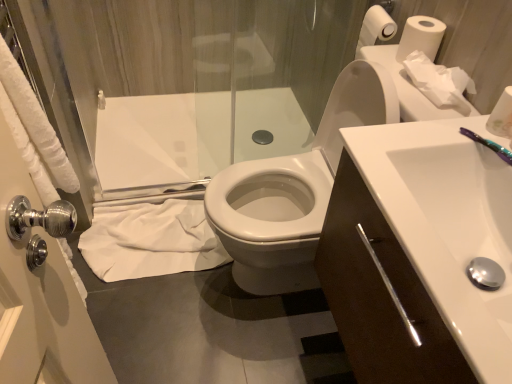
Find the location of a particular element. This screenshot has width=512, height=384. blank area to the left of white matte toilet paper at upper right, acting as the first toilet paper starting from the bottom is located at coordinates (426, 133).